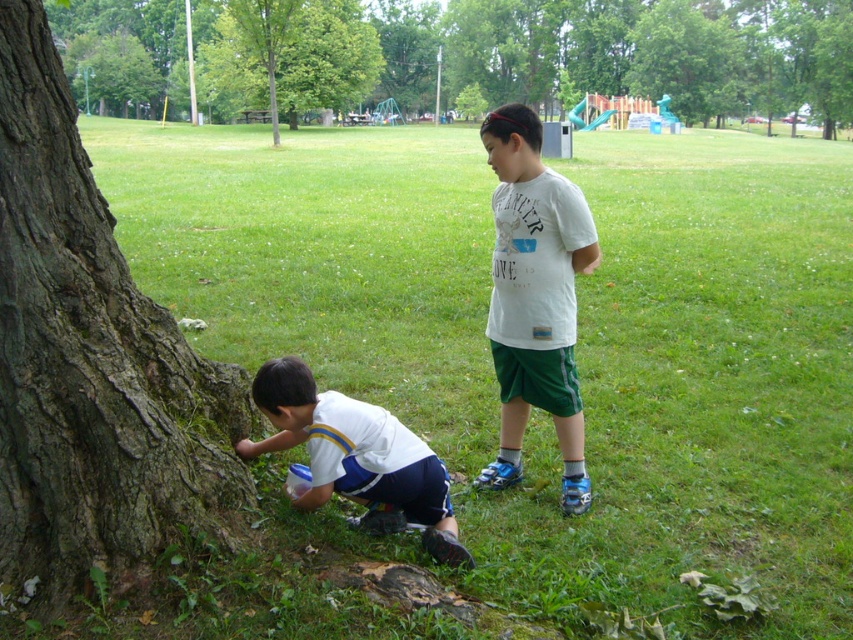
Can you confirm if brown rough bark tree trunk at lower left is shorter than green leafy tree at upper center?

Correct, brown rough bark tree trunk at lower left is not as tall as green leafy tree at upper center.

Is brown rough bark tree trunk at lower left above green leafy tree at upper center?

No, brown rough bark tree trunk at lower left is not above green leafy tree at upper center.

Who is more distant from viewer, (x=212, y=376) or (x=222, y=99)?

Positioned behind is point (x=222, y=99).

The width and height of the screenshot is (853, 640). I want to click on brown rough bark tree trunk at lower left, so click(91, 364).

Between smooth bark tree at left and green leafy tree at upper center, which one is positioned lower?

green leafy tree at upper center is lower down.

Who is more forward, (x=431, y=33) or (x=334, y=83)?

Positioned in front is point (x=334, y=83).

At what (x,y) coordinates should I click in order to perform the action: click on smooth bark tree at left. Please return your answer as a coordinate pair (x, y). This screenshot has height=640, width=853. Looking at the image, I should click on (532, 56).

Does green grass at lower left appear over white matte shirt at lower left?

Correct, green grass at lower left is located above white matte shirt at lower left.

Who is shorter, green grass at lower left or white matte shirt at lower left?

Standing shorter between the two is white matte shirt at lower left.

Does point (196, 240) come closer to viewer compared to point (245, 458)?

No.

Where is `green grass at lower left`? Image resolution: width=853 pixels, height=640 pixels. green grass at lower left is located at coordinates (577, 344).